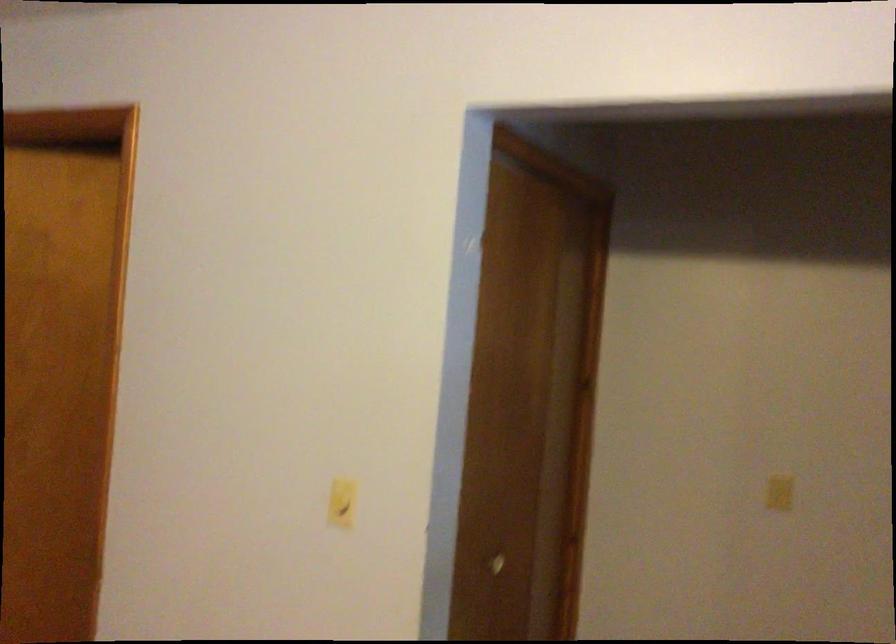
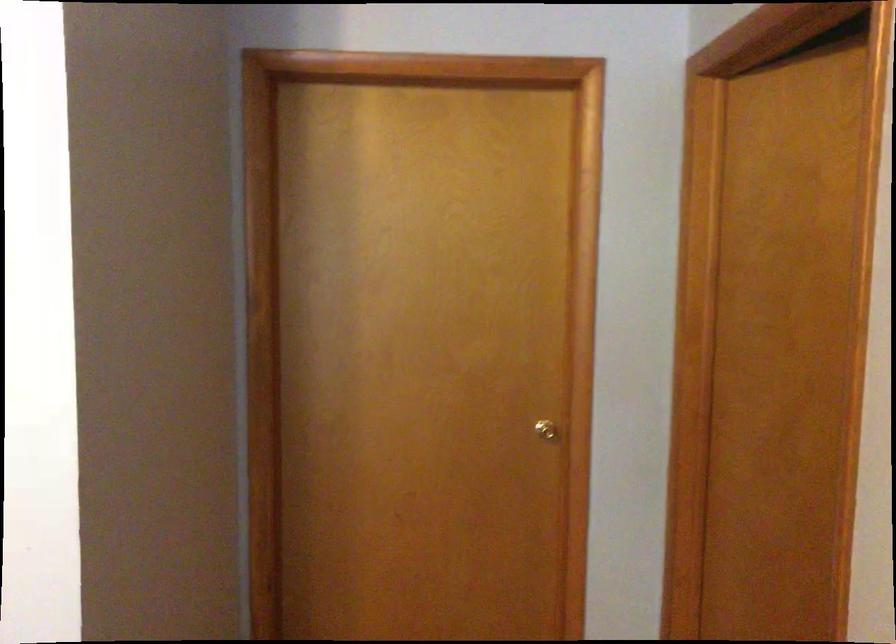
Question: The camera is either moving clockwise (left) or counter-clockwise (right) around the object. The first image is from the beginning of the video and the second image is from the end. Is the camera moving left or right when shooting the video?

Choices:
 (A) Left
 (B) Right

Answer: (B)